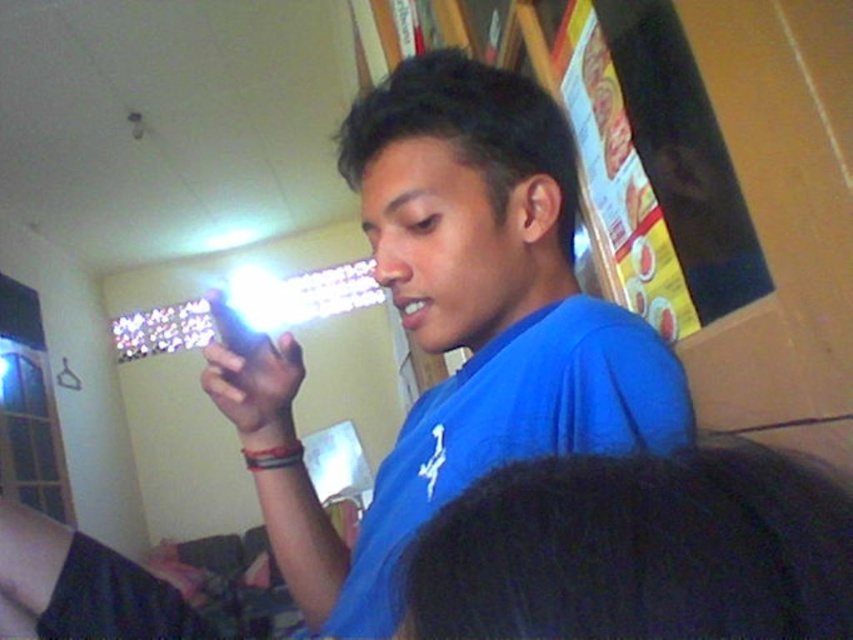
Looking at this image, you are taking a photo with your phone and want to focus on the point at coordinates point (447, 253). Will the point at coordinates point (289, 388) also be in focus if your camera has a depth of field that can only focus on objects at the same distance as the first point?

The point at coordinates point (447, 253) is closer to the camera than point (289, 388). Since the depth of field can only focus on objects at the same distance as the first point, the second point will not be in focus.

You are a photographer taking a picture of the blue matte shirt at center and the matte black phone at center. Which object should you focus on first if you want to capture both in the same frame without moving the camera?

You should focus on the blue matte shirt at center first because it is positioned to the right of the matte black phone at center, so adjusting focus to the right ensures both are in frame.